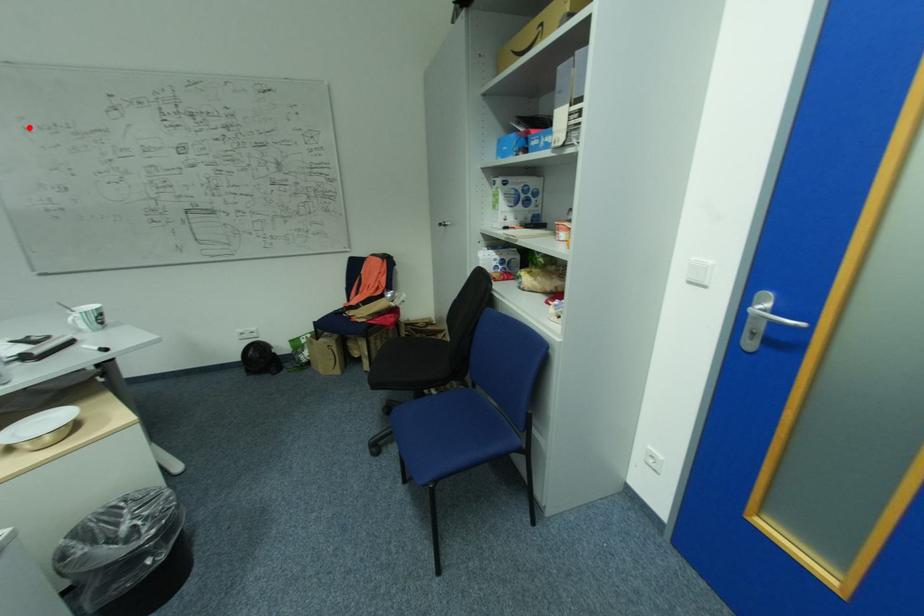
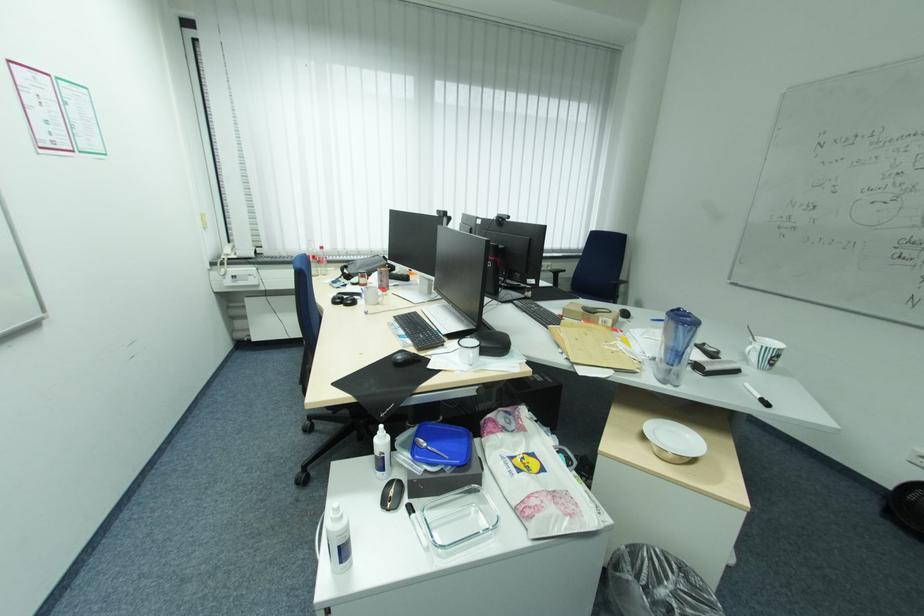
Question: I am providing you with two images of the same scene from different viewpoints. Given a red point in image1, look at the same physical point in image2. Is it:

Choices:
 (A) Closer to the viewpoint
 (B) Farther from the viewpoint

Answer: (A)